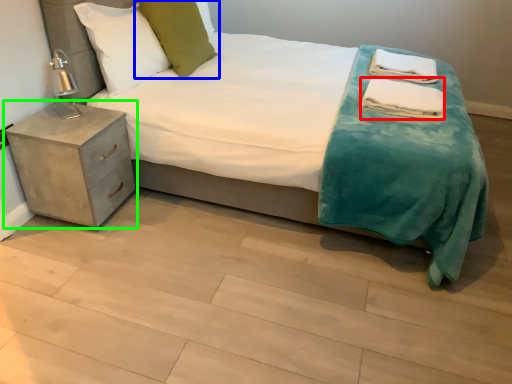
Question: Which is farther away from material (highlighted by a red box)? pillow (highlighted by a blue box) or nightstand (highlighted by a green box)?

Choices:
 (A) pillow
 (B) nightstand

Answer: (B)